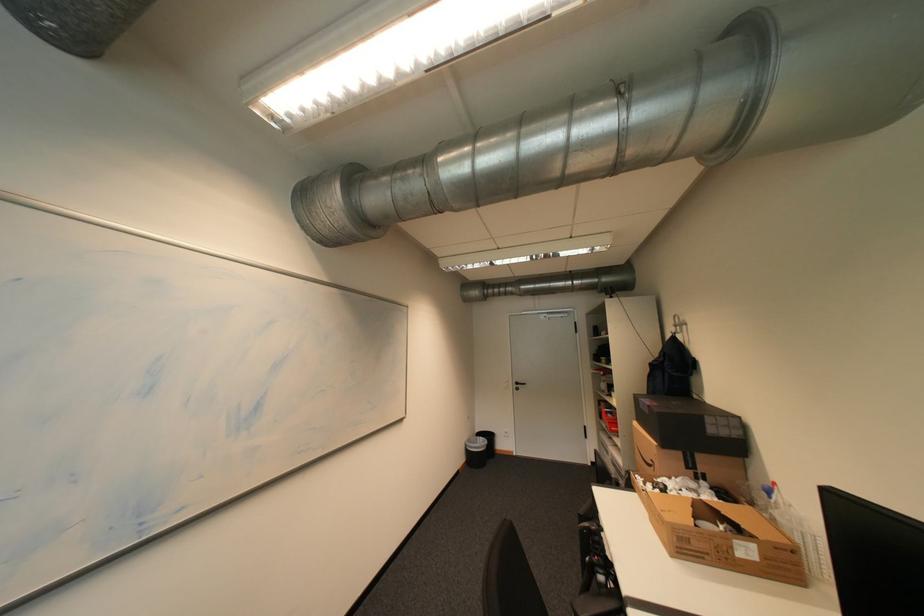
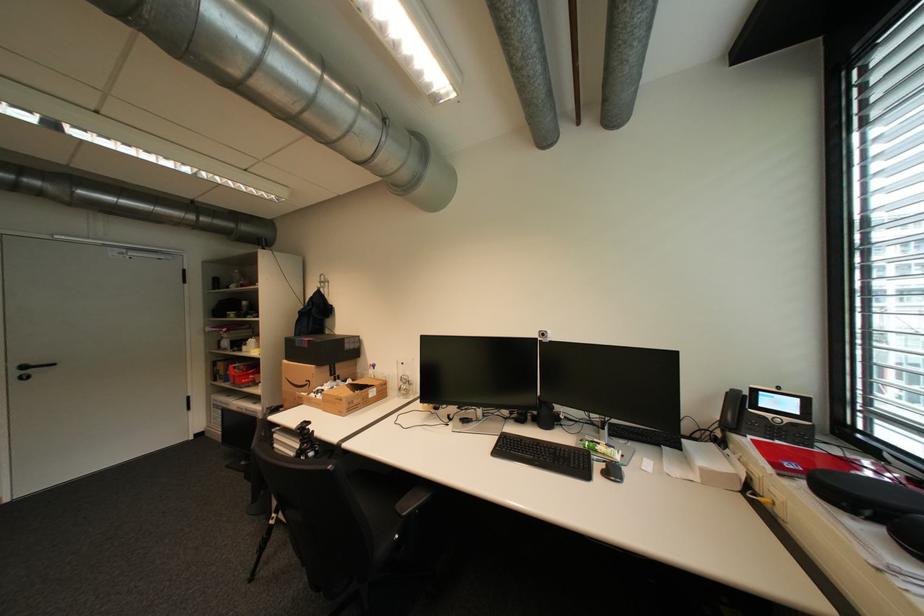
Find the pixel in the second image that matches point 662,464 in the first image.

(317, 383)